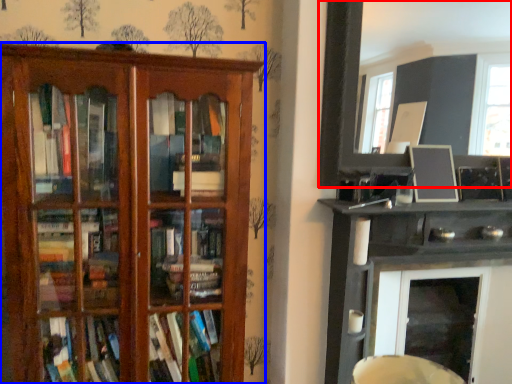
Question: Which of the following is the farthest to the observer, picture frame (highlighted by a red box) or shelf (highlighted by a blue box)?

Choices:
 (A) picture frame
 (B) shelf

Answer: (A)